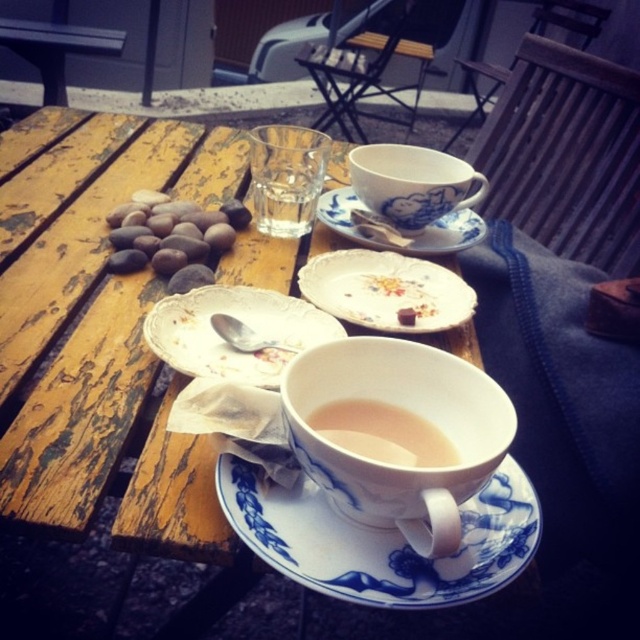
Which of these two, porcelain plate at center or blue porcelain cup at upper center, stands shorter?

Standing shorter between the two is porcelain plate at center.

Can you confirm if porcelain plate at center is taller than blue porcelain cup at upper center?

No, porcelain plate at center is not taller than blue porcelain cup at upper center.

Which is in front, point (307, 285) or point (362, 157)?

Positioned in front is point (307, 285).

Locate an element on the screen. The height and width of the screenshot is (640, 640). porcelain plate at center is located at coordinates (385, 291).

Is point (506, 566) farther from camera compared to point (208, 323)?

No, (506, 566) is closer to viewer.

Is blue porcelain saucer at center smaller than white porcelain plate at center?

Indeed, blue porcelain saucer at center has a smaller size compared to white porcelain plate at center.

Which is in front, point (355, 584) or point (289, 321)?

Point (355, 584) is in front.

The width and height of the screenshot is (640, 640). Identify the location of blue porcelain saucer at center. (380, 540).

At what (x,y) coordinates should I click in order to perform the action: click on white porcelain plate at center. Please return your answer as a coordinate pair (x, y). The image size is (640, 640). Looking at the image, I should click on (227, 340).

Is point (259, 332) behind point (385, 246)?

That is False.

I want to click on white porcelain plate at center, so click(227, 340).

Find the location of a particular element. This screenshot has width=640, height=640. white porcelain plate at center is located at coordinates (227, 340).